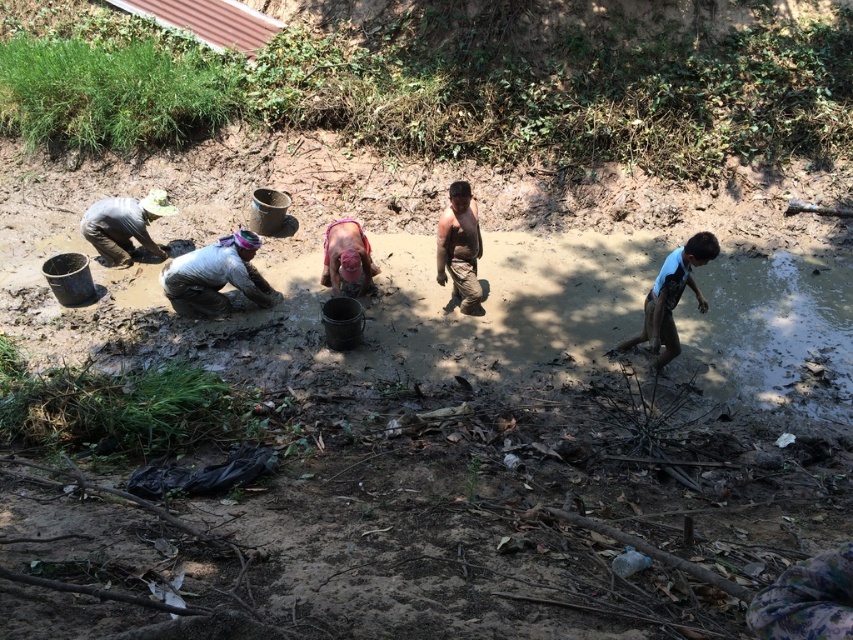
Is dark gray fabric shirt at left above pink fabric mask at center?

Yes.

Does point (109, 230) come closer to viewer compared to point (345, 259)?

No.

I want to click on dark gray fabric shirt at left, so click(123, 225).

Does bare skin/rough skin man at center appear over pink fabric mask at center?

Yes.

Is point (457, 198) positioned in front of point (341, 218)?

Yes, it is.

The image size is (853, 640). In order to click on bare skin/rough skin man at center in this screenshot , I will do `click(459, 246)`.

Does point (717, 244) come farther from viewer compared to point (358, 241)?

No, it is not.

Is blue matte shirt at right taller than pink fabric mask at center?

Yes, blue matte shirt at right is taller than pink fabric mask at center.

Which is behind, point (676, 294) or point (345, 278)?

Point (345, 278)

You are a GUI agent. You are given a task and a screenshot of the screen. Output one action in this format:
    pyautogui.click(x=<x>, y=<y>)
    Task: Click on the blue matte shirt at right
    
    Given the screenshot: What is the action you would take?
    pyautogui.click(x=671, y=298)